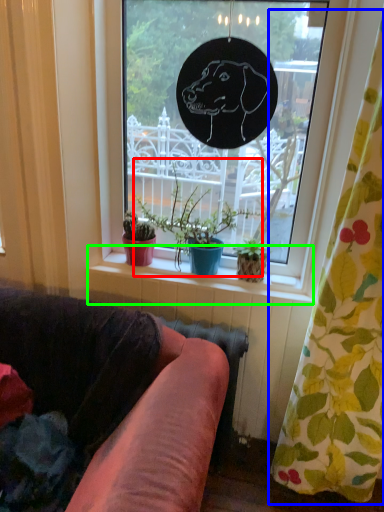
Question: Based on their relative distances, which object is nearer to houseplant (highlighted by a red box)? Choose from curtain (highlighted by a blue box) and window sill (highlighted by a green box).

Choices:
 (A) curtain
 (B) window sill

Answer: (B)